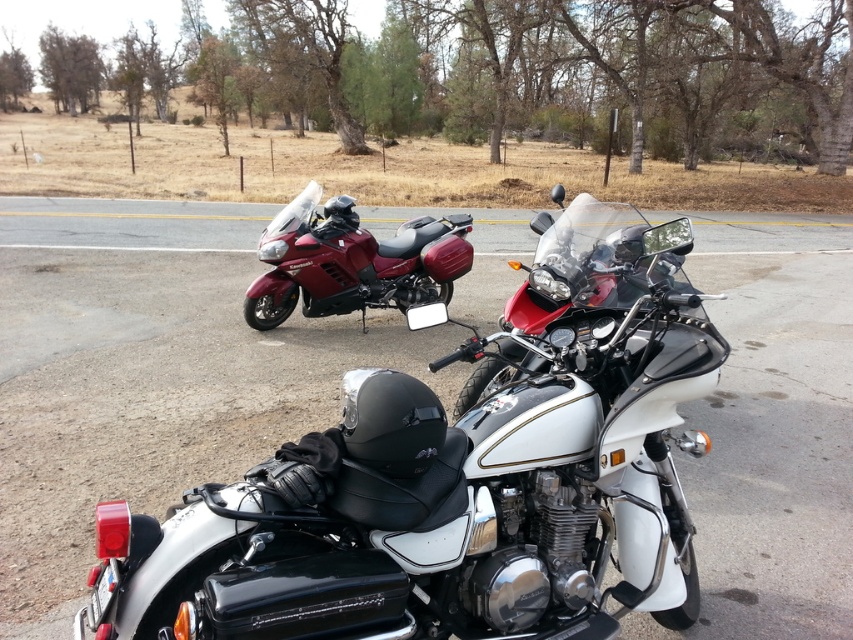
Question: Is white metallic motorcycle at center thinner than shiny black motorcycle at center?

Choices:
 (A) no
 (B) yes

Answer: (A)

Question: Can you confirm if white metallic motorcycle at center is positioned to the right of glossy red motorcycle at center?

Choices:
 (A) yes
 (B) no

Answer: (A)

Question: Does white metallic motorcycle at center have a larger size compared to shiny black motorcycle at center?

Choices:
 (A) no
 (B) yes

Answer: (B)

Question: Which point is closer to the camera taking this photo?

Choices:
 (A) (552, 262)
 (B) (141, 253)
 (C) (288, 291)

Answer: (A)

Question: Which of the following is the closest to the observer?

Choices:
 (A) (264, 275)
 (B) (596, 264)

Answer: (B)

Question: Which point is farther to the camera?

Choices:
 (A) glossy red motorcycle at center
 (B) shiny black motorcycle at center

Answer: (A)